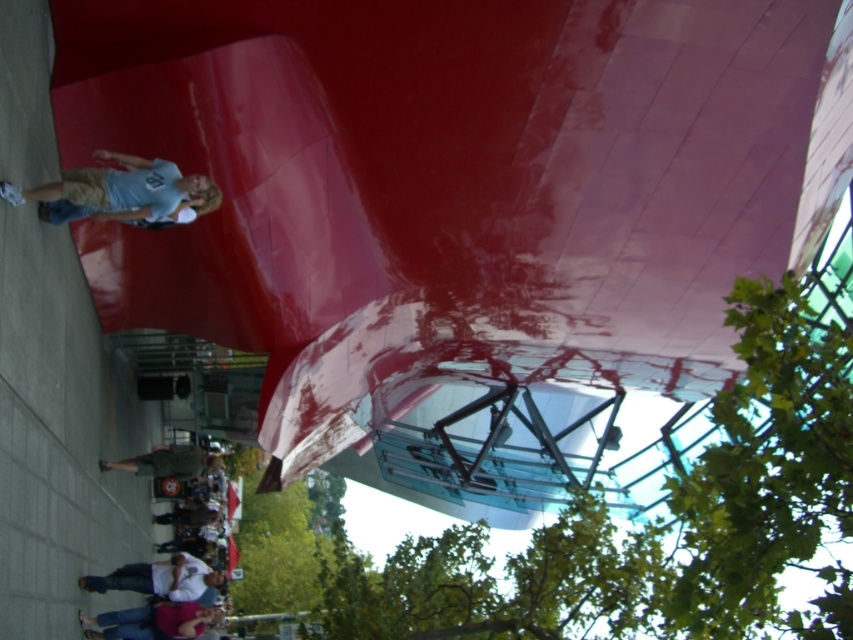
Question: Which object is positioned closest to the white matte skateboard at lower center?

Choices:
 (A) light blue t-shirt at left
 (B) denim pants at lower center

Answer: (B)

Question: Considering the relative positions of denim pants at lower center and white matte skateboard at lower center in the image provided, where is denim pants at lower center located with respect to white matte skateboard at lower center?

Choices:
 (A) below
 (B) above

Answer: (A)

Question: Which of the following is the closest to the observer?

Choices:
 (A) white matte skateboard at lower center
 (B) denim pants at lower center
 (C) light blue t-shirt at left

Answer: (C)

Question: Which of the following is the closest to the observer?

Choices:
 (A) (117, 616)
 (B) (77, 180)
 (C) (177, 554)

Answer: (B)

Question: Is light blue t-shirt at left positioned at the back of denim pants at lower center?

Choices:
 (A) yes
 (B) no

Answer: (B)

Question: Is light blue t-shirt at left thinner than denim pants at lower center?

Choices:
 (A) yes
 (B) no

Answer: (B)